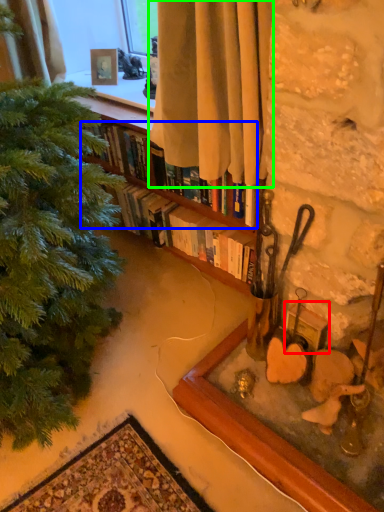
Question: Which object is positioned farthest from picture frame (highlighted by a red box)? Select from book (highlighted by a blue box) and curtain (highlighted by a green box).

Choices:
 (A) book
 (B) curtain

Answer: (B)